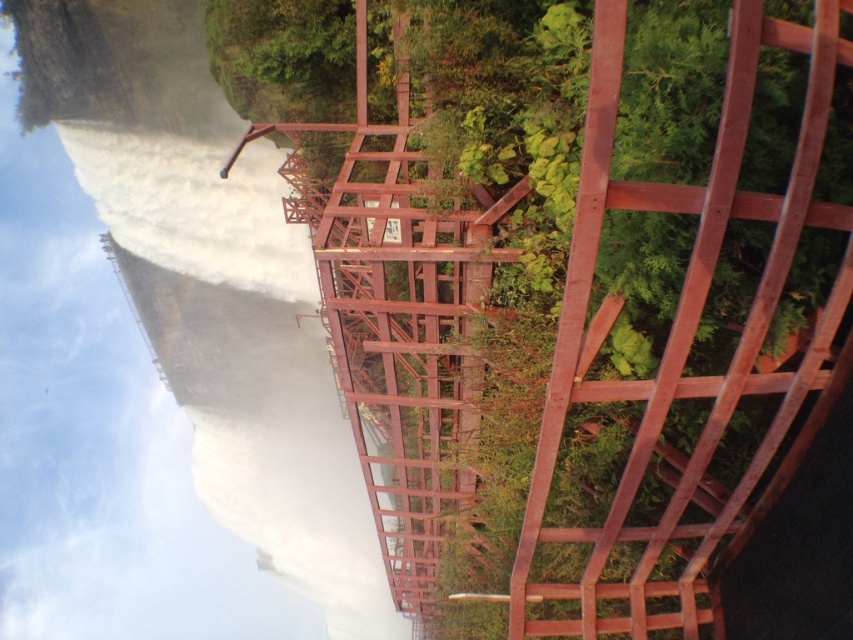
Who is lower down, rusty metal bridge at upper center or white mist at left?

Positioned lower is white mist at left.

Measure the distance from rusty metal bridge at upper center to white mist at left.

The distance of rusty metal bridge at upper center from white mist at left is 53.16 meters.

I want to click on rusty metal bridge at upper center, so click(567, 284).